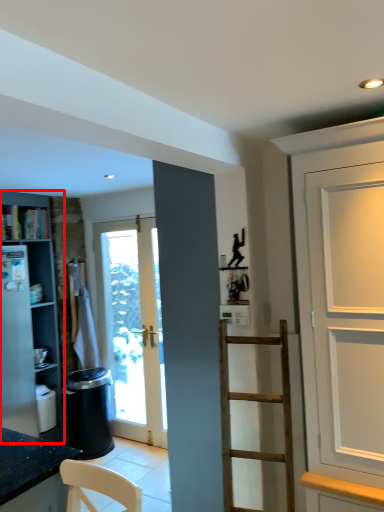
Question: From the image's perspective, what is the correct spatial positioning of cabinetry (annotated by the red box) in reference to cabinet?

Choices:
 (A) below
 (B) above

Answer: (A)